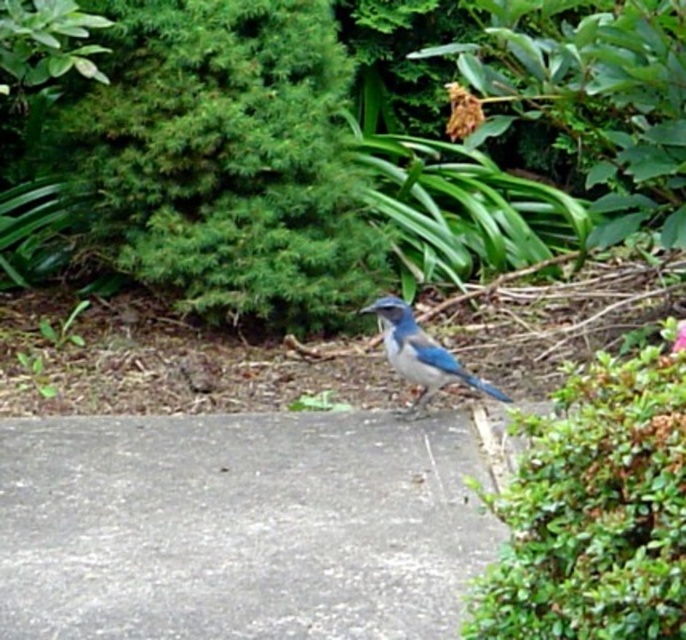
Question: Can you confirm if gray concrete pavement at center is positioned to the right of green leafy bush at upper left?

Choices:
 (A) yes
 (B) no

Answer: (A)

Question: Considering the real-world distances, which object is farthest from the green leafy bush at upper left?

Choices:
 (A) blue glossy bird at center
 (B) green leafy bush at right

Answer: (B)

Question: Which of these objects is positioned farthest from the blue glossy bird at center?

Choices:
 (A) gray concrete pavement at center
 (B) green leafy bush at right

Answer: (B)

Question: Among these points, which one is nearest to the camera?

Choices:
 (A) (676, 346)
 (B) (405, 416)
 (C) (178, 54)
 (D) (390, 566)

Answer: (D)

Question: Can you confirm if green leafy bush at upper left is thinner than blue glossy bird at center?

Choices:
 (A) yes
 (B) no

Answer: (B)

Question: Can you confirm if green leafy bush at upper left is bigger than green leafy bush at right?

Choices:
 (A) no
 (B) yes

Answer: (B)